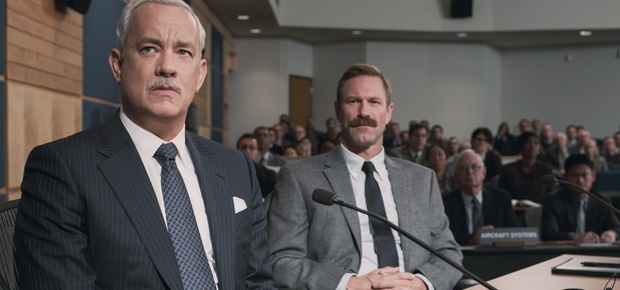
At what (x,y) coordinates should I click in order to perform the action: click on light. Please return your answer as a coordinate pair (x, y). Looking at the image, I should click on (589, 33), (250, 19), (260, 28), (459, 42), (353, 28).